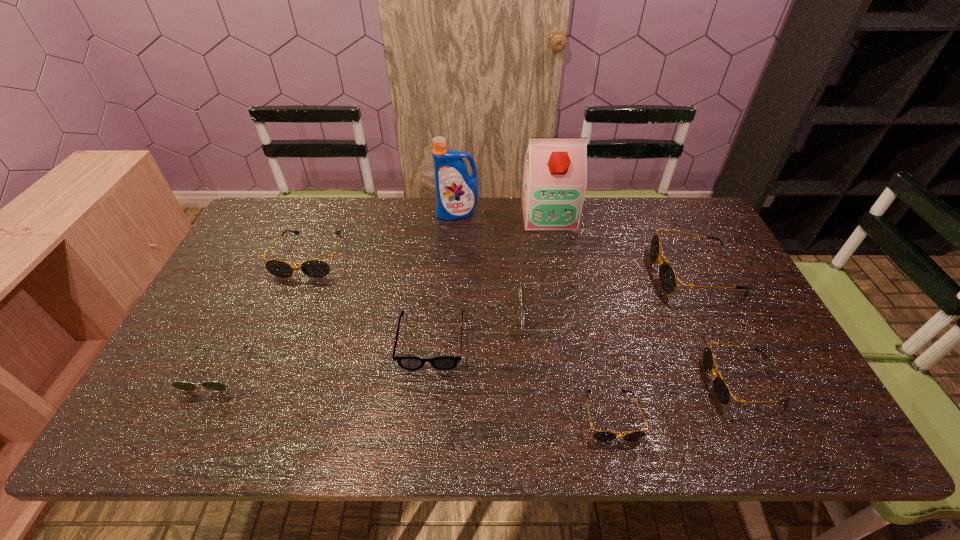
You are a GUI agent. You are given a task and a screenshot of the screen. Output one action in this format:
    pyautogui.click(x=<x>, y=<y>)
    Task: Click on the nearer green sunglasses
    The height and width of the screenshot is (540, 960).
    Given the screenshot: What is the action you would take?
    pyautogui.click(x=180, y=385)

Identify the location of the left green sunglasses. (180, 385).

You are a GUI agent. You are given a task and a screenshot of the screen. Output one action in this format:
    pyautogui.click(x=<x>, y=<y>)
    Task: Click on the smallest black sunglasses
    The image size is (960, 540).
    Given the screenshot: What is the action you would take?
    point(599,435)

Find the location of a particular element. vacant region located with the cap open on the soya milk is located at coordinates (566, 310).

This screenshot has height=540, width=960. Identify the location of free space located 0.180m on the label of the detergent. (454, 256).

Where is `vacant space located on the front-facing side of the seventh shortest object`? This screenshot has width=960, height=540. vacant space located on the front-facing side of the seventh shortest object is located at coordinates (523, 274).

I want to click on vacant space positioned on the front-facing side of the seventh shortest object, so (x=533, y=274).

This screenshot has width=960, height=540. I want to click on free space located on the front-facing side of the seventh shortest object, so click(x=587, y=274).

Find the location of a particular element. free space located 0.160m on the front-facing side of the second biggest black sunglasses is located at coordinates (283, 322).

Locate an element on the screen. vacant area situated on the front-facing side of the farther green sunglasses is located at coordinates (436, 314).